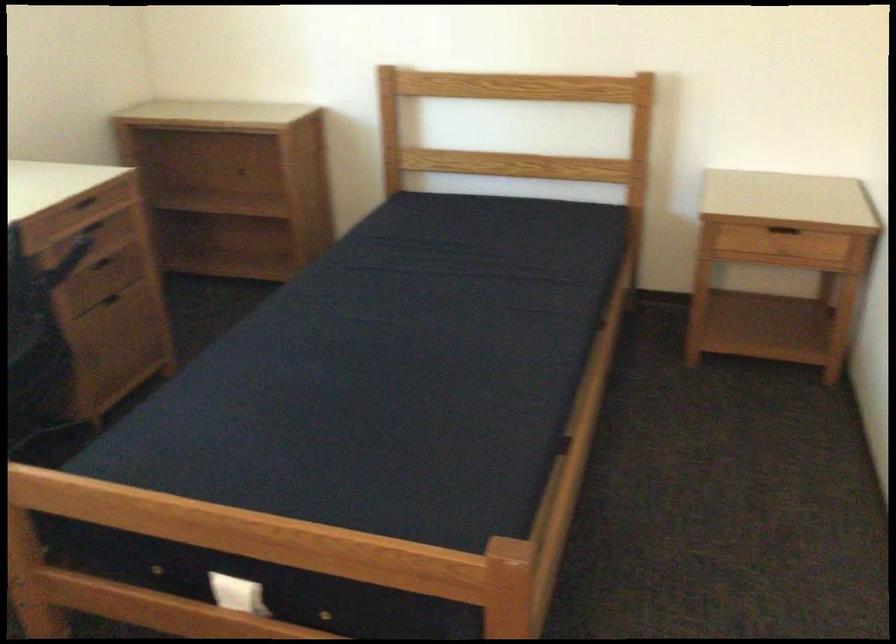
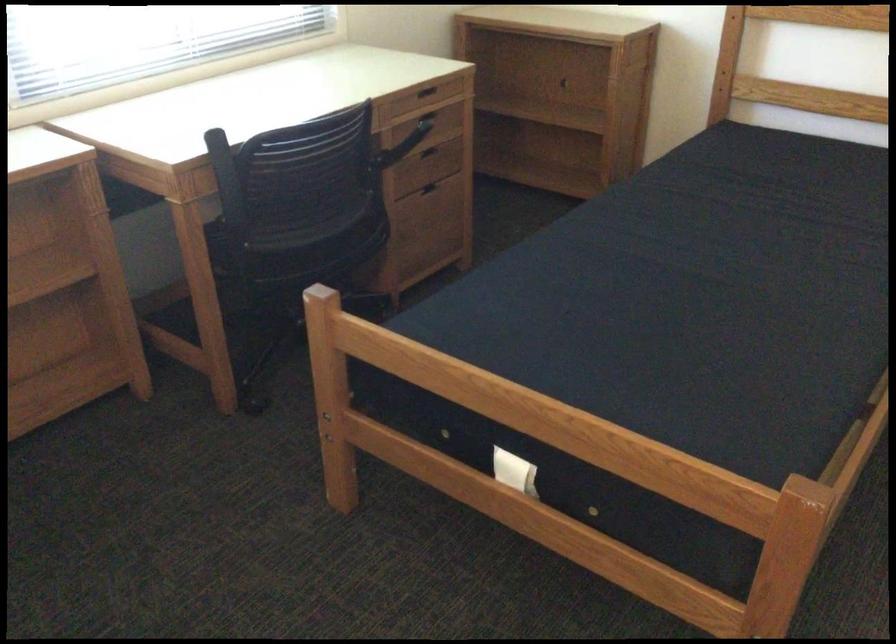
Where in the second image is the point corresponding to (x=82, y=205) from the first image?

(424, 91)